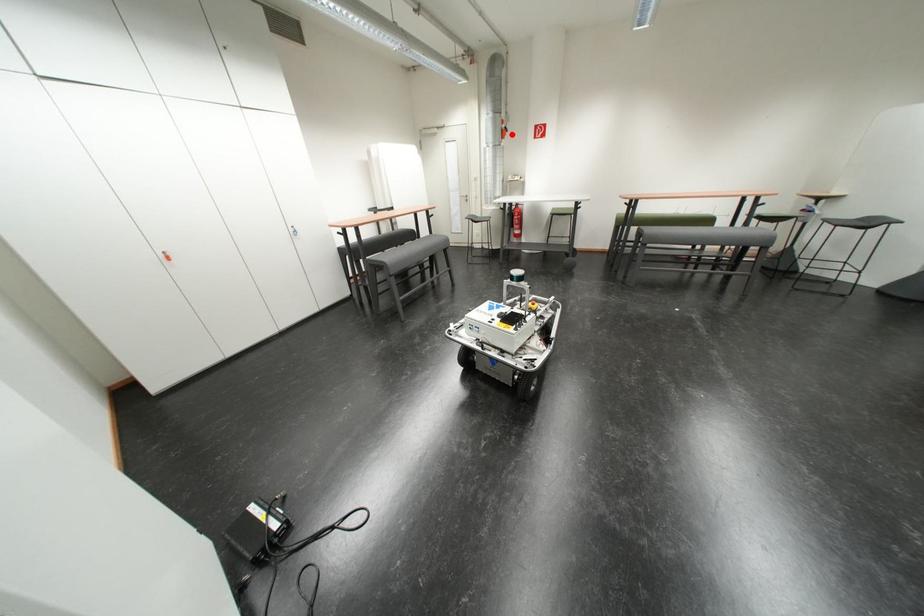
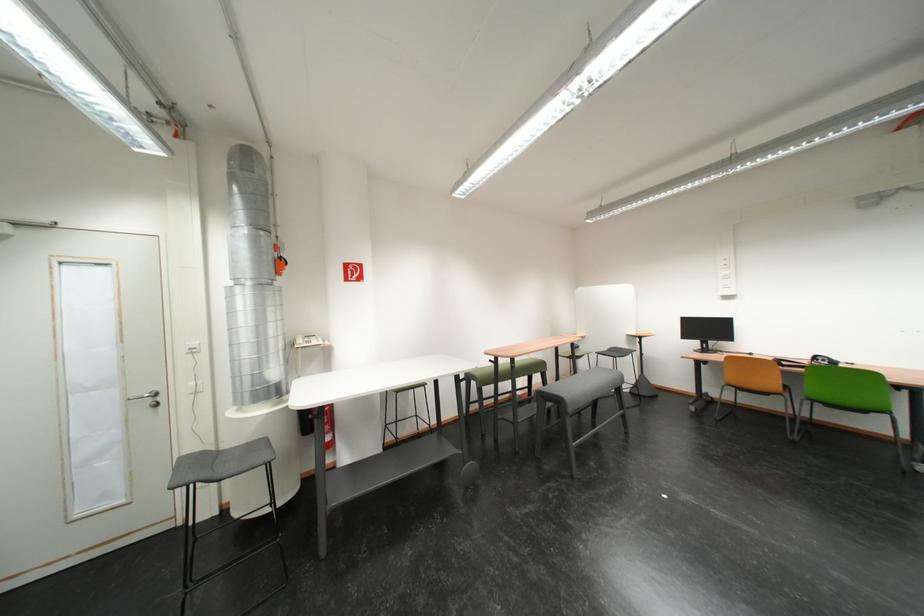
Locate, in the second image, the point that corresponds to the highlighted location in the first image.

(284, 265)